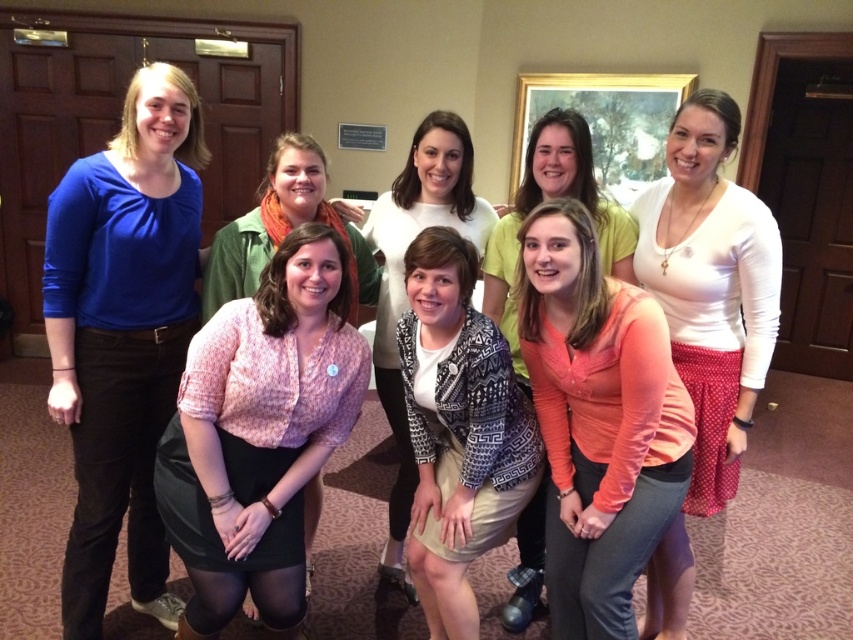
Question: Which point is closer to the camera taking this photo?

Choices:
 (A) (596, 218)
 (B) (235, 422)

Answer: (B)

Question: Is pink textured blouse at center closer to camera compared to patterned sweater at center?

Choices:
 (A) no
 (B) yes

Answer: (B)

Question: Estimate the real-world distances between objects in this image. Which object is farther from the white matte shirt at center?

Choices:
 (A) matte coral blouse at center
 (B) patterned sweater at center
 (C) patterned knit cardigan at center
 (D) pink textured blouse at center

Answer: (D)

Question: Is white matte shirt at center thinner than patterned knit cardigan at center?

Choices:
 (A) yes
 (B) no

Answer: (A)

Question: Can you confirm if white matte shirt at center is wider than matte coral blouse at center?

Choices:
 (A) no
 (B) yes

Answer: (A)

Question: Which point is closer to the camera?

Choices:
 (A) (590, 172)
 (B) (212, 621)
 (C) (675, 134)

Answer: (B)